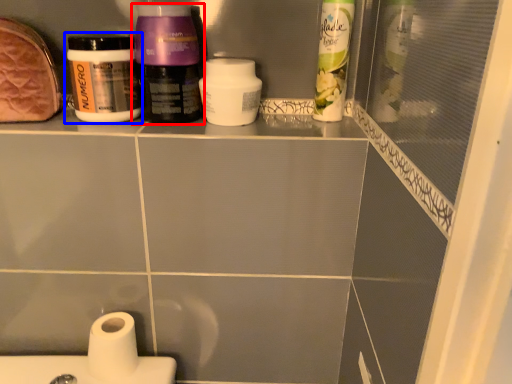
Question: Among these objects, which one is nearest to the camera, bottle (highlighted by a red box) or bottle (highlighted by a blue box)?

Choices:
 (A) bottle
 (B) bottle

Answer: (A)